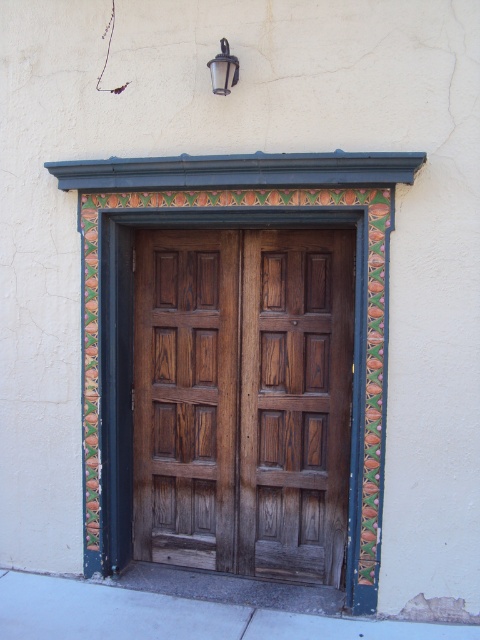
Question: Which point is closer to the camera taking this photo?

Choices:
 (A) (143, 548)
 (B) (225, 51)

Answer: (B)

Question: Which object is closer to the camera taking this photo?

Choices:
 (A) wooden panelled door at center
 (B) matte glass lamp at upper center

Answer: (B)

Question: Which point is closer to the camera taking this photo?

Choices:
 (A) (222, 77)
 (B) (254, 513)

Answer: (A)

Question: Where is wooden panelled door at center located in relation to matte glass lamp at upper center in the image?

Choices:
 (A) below
 (B) above

Answer: (A)

Question: Does wooden panelled door at center come behind matte glass lamp at upper center?

Choices:
 (A) yes
 (B) no

Answer: (A)

Question: Considering the relative positions of wooden panelled door at center and matte glass lamp at upper center in the image provided, where is wooden panelled door at center located with respect to matte glass lamp at upper center?

Choices:
 (A) left
 (B) right

Answer: (B)